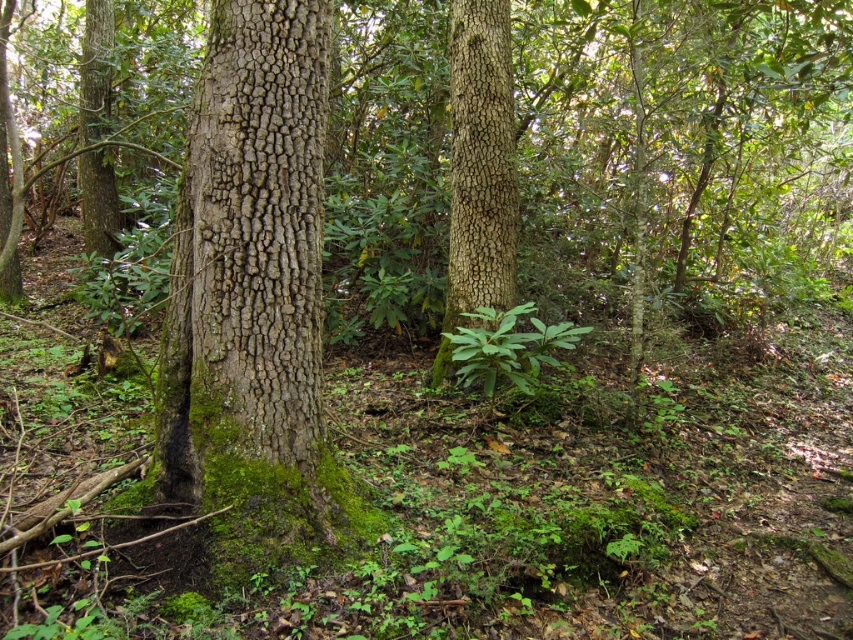
You are a hiker in the forest and want to touch the closest tree trunk. Which one should you approach, the green mossy bark tree trunk at center or the smooth brown bark at center?

The green mossy bark tree trunk at center is closer to the viewer than the smooth brown bark at center, so you should approach the green mossy bark tree trunk at center.

You are a hiker trying to identify two tree trunks in the forest. You notice the green mossy bark tree trunk at center and the smooth brown bark at center. Which of these two trunks is smaller in size?

The green mossy bark tree trunk at center is smaller in size compared to the smooth brown bark at center.